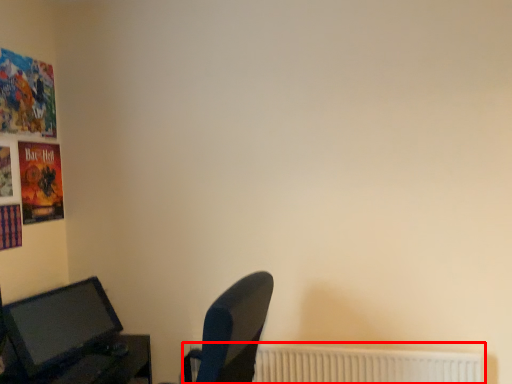
Question: From the image, what is the correct spatial relationship of radiator (annotated by the red box) in relation to computer monitor?

Choices:
 (A) right
 (B) left

Answer: (A)